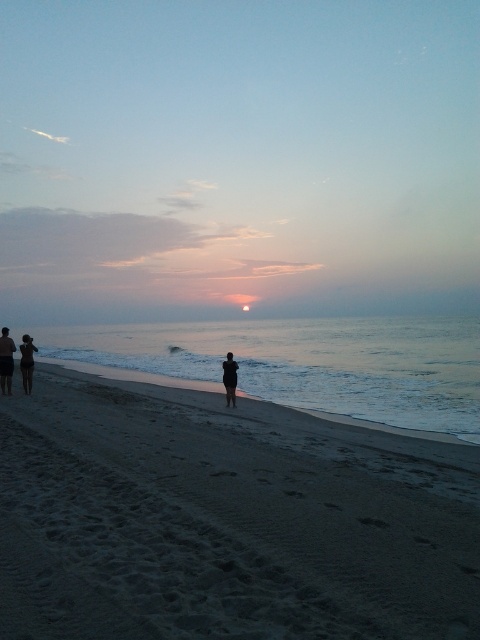
Who is positioned more to the right, silhouette figure at lower left or black matte figure at center?

Positioned to the right is black matte figure at center.

Does silhouette figure at lower left appear over black matte figure at center?

Correct, silhouette figure at lower left is located above black matte figure at center.

Measure the distance between point (31, 346) and camera.

A distance of 19.73 meters exists between point (31, 346) and camera.

Locate an element on the screen. The height and width of the screenshot is (640, 480). silhouette figure at lower left is located at coordinates (26, 362).

Can you confirm if dark blue shorts at lower left is positioned to the right of black matte figure at center?

No, dark blue shorts at lower left is not to the right of black matte figure at center.

Which is more to the left, dark blue shorts at lower left or black matte figure at center?

From the viewer's perspective, dark blue shorts at lower left appears more on the left side.

Who is more forward, (3, 340) or (228, 388)?

Point (228, 388)

Locate an element on the screen. The image size is (480, 640). dark blue shorts at lower left is located at coordinates (6, 360).

At what (x,y) coordinates should I click in order to perform the action: click on smooth blue water at center. Please return your answer as a coordinate pair (x, y). The height and width of the screenshot is (640, 480). Looking at the image, I should click on (305, 362).

Does smooth blue water at center have a larger size compared to black matte figure at center?

Yes.

Where is `smooth blue water at center`? The image size is (480, 640). smooth blue water at center is located at coordinates (305, 362).